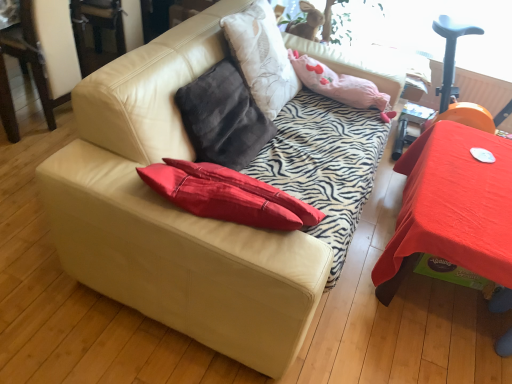
Question: Is fuzzy beige rabbit at upper center located outside pink fabric pillow at upper center?

Choices:
 (A) no
 (B) yes

Answer: (B)

Question: Does fuzzy beige rabbit at upper center have a larger size compared to pink fabric pillow at upper center?

Choices:
 (A) yes
 (B) no

Answer: (B)

Question: Is fuzzy beige rabbit at upper center shorter than pink fabric pillow at upper center?

Choices:
 (A) yes
 (B) no

Answer: (B)

Question: Is fuzzy beige rabbit at upper center at the left side of pink fabric pillow at upper center?

Choices:
 (A) no
 (B) yes

Answer: (B)

Question: From the image's perspective, would you say fuzzy beige rabbit at upper center is shown under pink fabric pillow at upper center?

Choices:
 (A) yes
 (B) no

Answer: (B)

Question: Does fuzzy beige rabbit at upper center have a greater height compared to pink fabric pillow at upper center?

Choices:
 (A) yes
 (B) no

Answer: (A)

Question: Does beige leather couch at center lie in front of pink fabric pillow at upper center?

Choices:
 (A) yes
 (B) no

Answer: (A)

Question: Does beige leather couch at center appear on the left side of pink fabric pillow at upper center?

Choices:
 (A) no
 (B) yes

Answer: (B)

Question: Is beige leather couch at center next to pink fabric pillow at upper center?

Choices:
 (A) yes
 (B) no

Answer: (B)

Question: From the image's perspective, does beige leather couch at center appear lower than pink fabric pillow at upper center?

Choices:
 (A) yes
 (B) no

Answer: (A)

Question: Is beige leather couch at center facing towards pink fabric pillow at upper center?

Choices:
 (A) yes
 (B) no

Answer: (A)

Question: Considering the relative sizes of beige leather couch at center and pink fabric pillow at upper center in the image provided, is beige leather couch at center wider than pink fabric pillow at upper center?

Choices:
 (A) yes
 (B) no

Answer: (A)

Question: Can you confirm if smooth red table at right is taller than fuzzy beige rabbit at upper center?

Choices:
 (A) yes
 (B) no

Answer: (A)